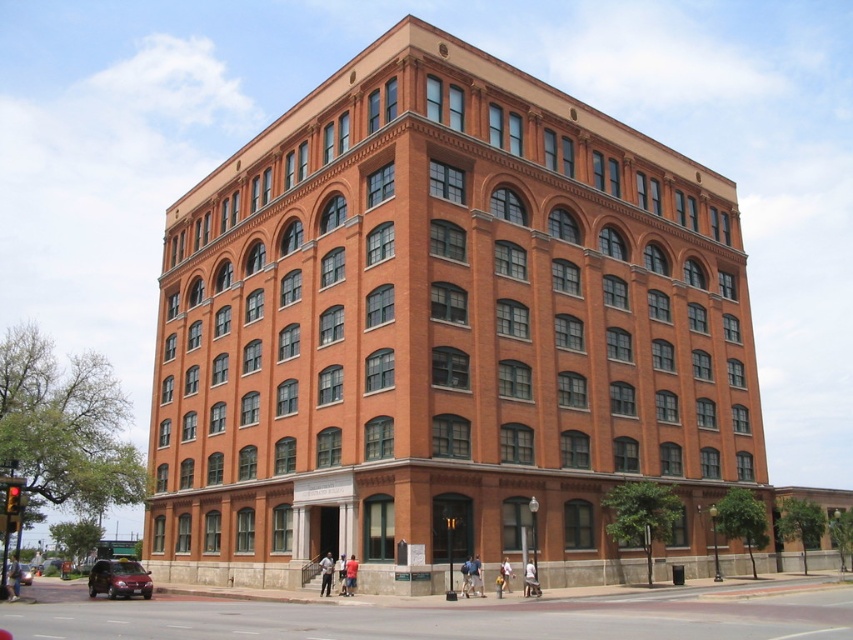
Question: Which point appears farthest from the camera in this image?

Choices:
 (A) [27, 580]
 (B) [144, 572]

Answer: (A)

Question: Which point is farther to the camera?

Choices:
 (A) (90, 577)
 (B) (27, 564)

Answer: (B)

Question: Is metallic red sedan at lower left closer to camera compared to shiny black sedan at lower left?

Choices:
 (A) no
 (B) yes

Answer: (A)

Question: Which object is closer to the camera taking this photo?

Choices:
 (A) shiny black sedan at lower left
 (B) metallic red sedan at lower left

Answer: (A)

Question: Where is metallic red sedan at lower left located in relation to shiny black sedan at lower left in the image?

Choices:
 (A) left
 (B) right

Answer: (B)

Question: Does metallic red sedan at lower left appear under shiny black sedan at lower left?

Choices:
 (A) yes
 (B) no

Answer: (B)